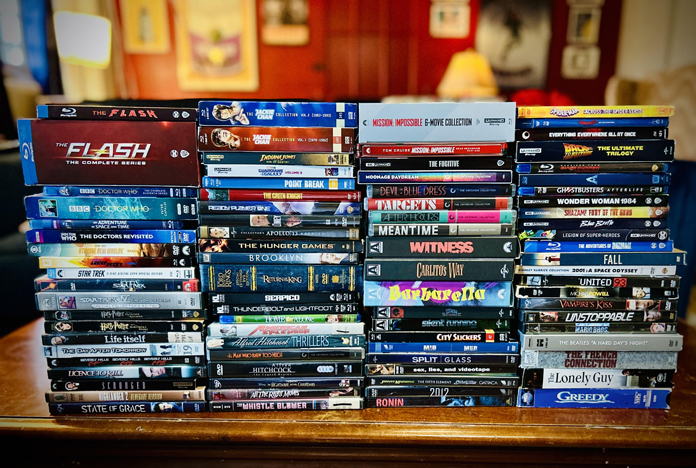
Identify the location of background wall mounted decorations. This screenshot has height=468, width=696. (148, 27), (228, 51), (452, 23), (523, 45), (582, 63), (582, 31), (285, 26), (582, 2).